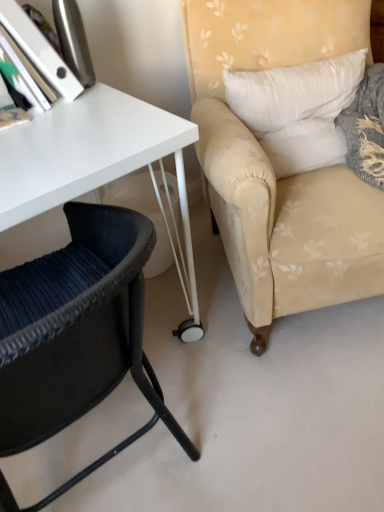
Question: Is black woven chair at lower left, arranged as the 2th chair when viewed from the right, spatially inside white fabric pillow at upper right, or outside of it?

Choices:
 (A) inside
 (B) outside

Answer: (B)

Question: From the image's perspective, is black woven chair at lower left, which ranks as the 1th chair in left-to-right order, positioned above or below white fabric pillow at upper right?

Choices:
 (A) below
 (B) above

Answer: (A)

Question: Estimate the real-world distances between objects in this image. Which object is farther from the beige floral fabric armchair at right, which is the second chair in left-to-right order?

Choices:
 (A) black woven chair at lower left, which ranks as the 1th chair in left-to-right order
 (B) white fabric pillow at upper right

Answer: (A)

Question: Estimate the real-world distances between objects in this image. Which object is closer to the beige floral fabric armchair at right, which is the second chair in left-to-right order?

Choices:
 (A) black woven chair at lower left, which ranks as the 1th chair in left-to-right order
 (B) white fabric pillow at upper right

Answer: (B)